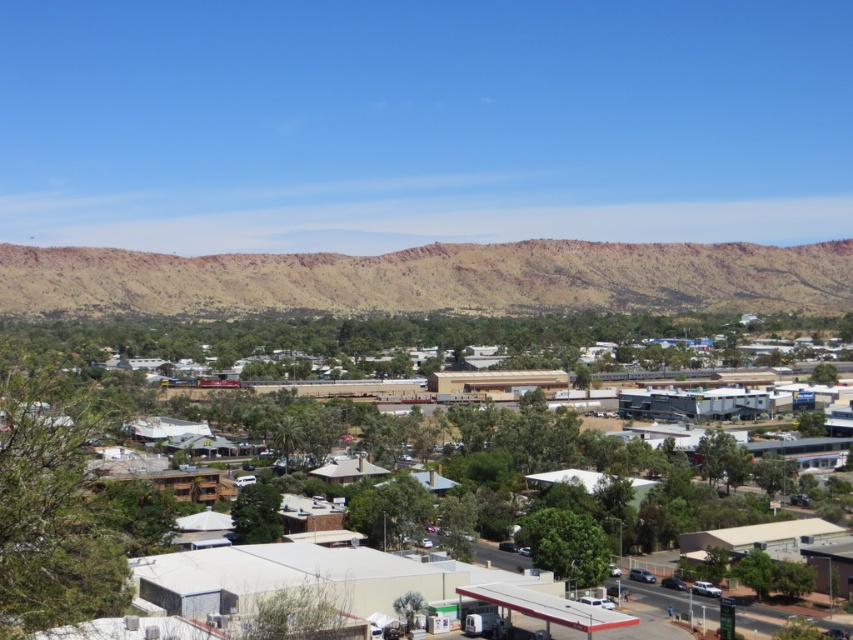
The width and height of the screenshot is (853, 640). Describe the element at coordinates (434, 278) in the screenshot. I see `rustic sandstone mountain at center` at that location.

Who is more forward, (699, 304) or (608, 440)?

Point (608, 440) is in front.

You are a GUI agent. You are given a task and a screenshot of the screen. Output one action in this format:
    pyautogui.click(x=<x>, y=<y>)
    Task: Click on the rustic sandstone mountain at center
    The image size is (853, 640).
    Given the screenshot: What is the action you would take?
    pyautogui.click(x=434, y=278)